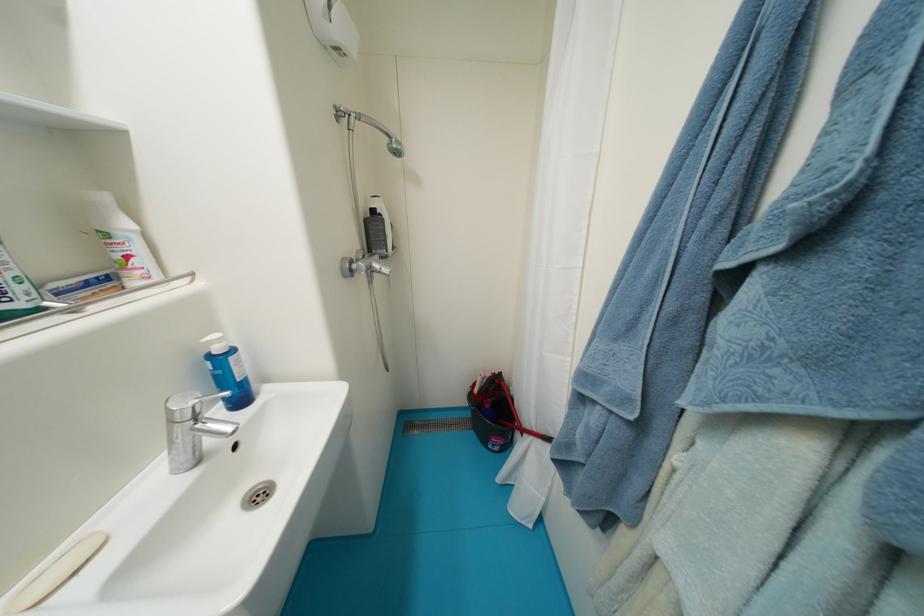
The width and height of the screenshot is (924, 616). Find the location of `black dispenser pump`. black dispenser pump is located at coordinates (377, 233).